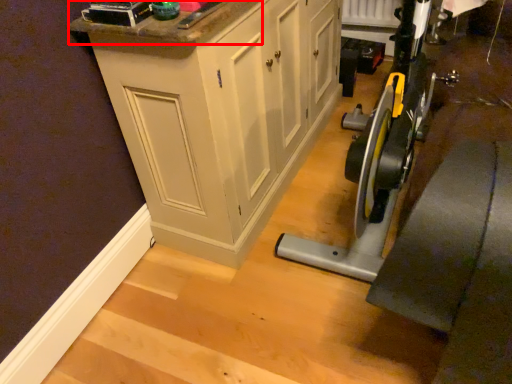
Question: From the image's perspective, where is counter top (annotated by the red box) located relative to cabinetry?

Choices:
 (A) below
 (B) above

Answer: (A)